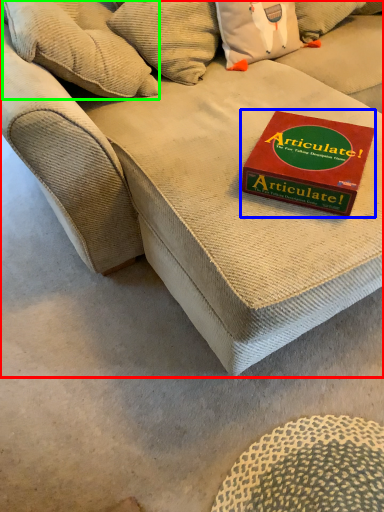
Question: Which is nearer to the studio couch (highlighted by a red box)? paperback book (highlighted by a blue box) or pillow (highlighted by a green box).

Choices:
 (A) paperback book
 (B) pillow

Answer: (A)